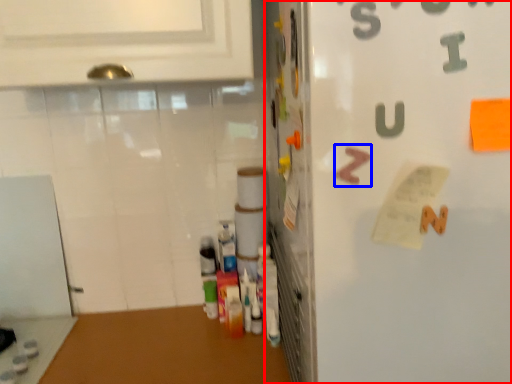
Question: Which point is closer to the camera, refrigerator (highlighted by a red box) or alphabet (highlighted by a blue box)?

Choices:
 (A) refrigerator
 (B) alphabet

Answer: (A)